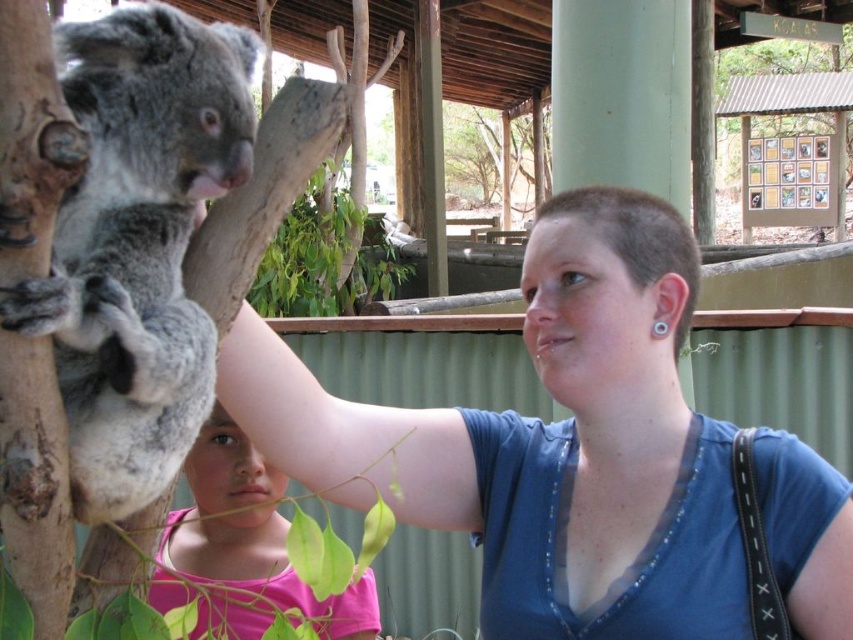
From the picture: You are a zookeeper observing the koala and the visitors. From your perspective, is the gray furry koala at left located above or below the pink fabric shirt at lower left?

The gray furry koala at left is positioned over the pink fabric shirt at lower left, so it is located above the pink fabric shirt at lower left.

You are standing at the entrance of the zoo and want to take a photo of the koala. The zoo has a rule that visitors must stay at least 5 feet away from the animals. Is the point at coordinates point (527,426) within the allowed distance?

The distance of point (527,426) from the viewer is 4.94 feet, which is less than the required 5 feet. Therefore, the point is too close to take a photo from without violating the zoo rule.